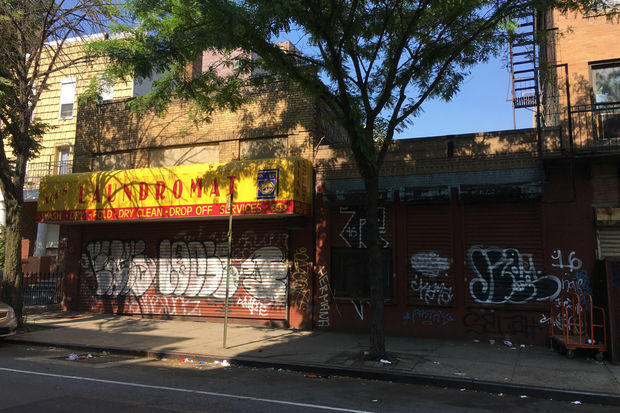
Where is `window`? This screenshot has width=620, height=413. window is located at coordinates (67, 110).